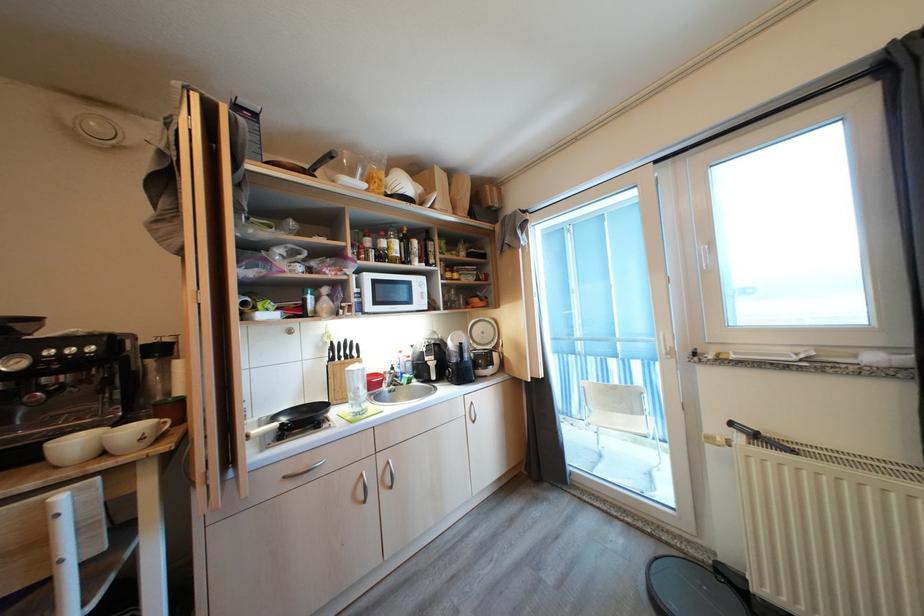
This screenshot has height=616, width=924. Identify the location of black knife handle. (343, 350).